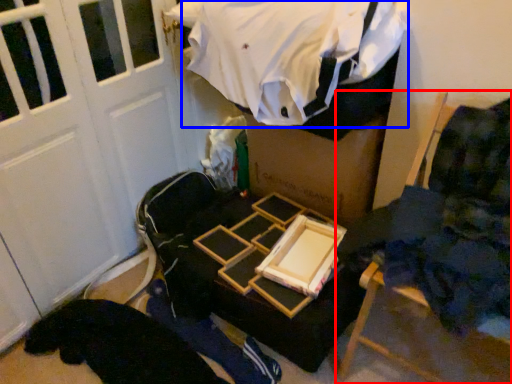
Question: Which object appears closest to the camera in this image, furniture (highlighted by a red box) or clothing (highlighted by a blue box)?

Choices:
 (A) furniture
 (B) clothing

Answer: (A)